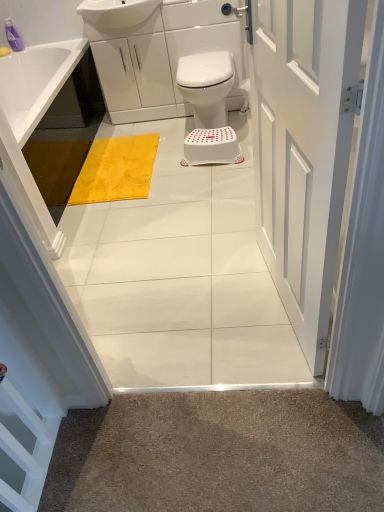
The width and height of the screenshot is (384, 512). Identify the location of vacant space situated above yellow plush bath mat at center (from a real-world perspective). (122, 164).